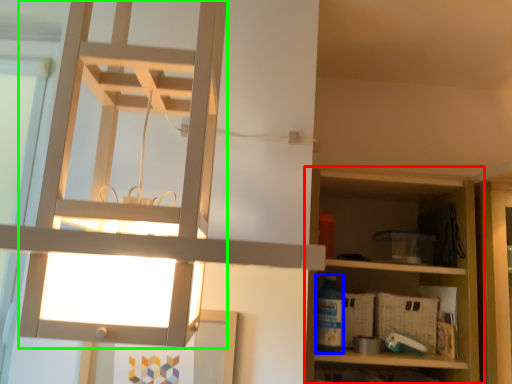
Question: Considering the real-world distances, which object is closest to shelf (highlighted by a red box)? bottle (highlighted by a blue box) or lamp (highlighted by a green box).

Choices:
 (A) bottle
 (B) lamp

Answer: (A)